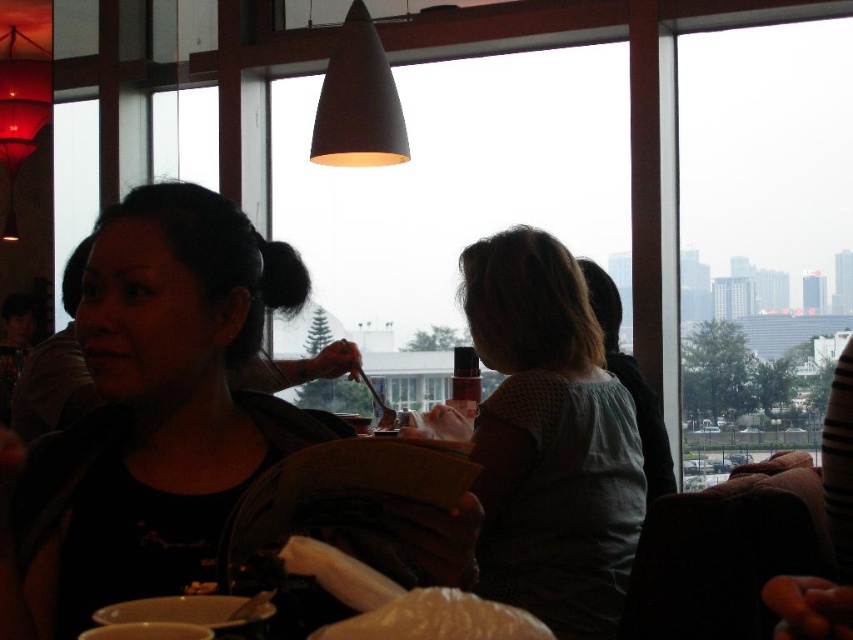
Looking at this image, you are a waiter in this restaurant and need to place a new menu on the table. The menu is 10 cm tall. There is space between the matte black shirt at center and the white fluffy bread at center. Can the menu fit vertically between them?

The matte black shirt at center is taller than the white fluffy bread at center. Since the menu is 10 cm tall, and the vertical space between them must be at least 10 cm, but the description only states the shirt is taller, not the available space. Therefore, it is uncertain if the menu will fit without more information about the actual space between them.

You are a customer sitting at the table in the restaurant. You want to see the city view outside through the transparent glass window at upper right, but the matte black shirt at center is blocking your view. Can you tell me which object you need to move to see the window?

The matte black shirt at center is shorter than the transparent glass window at upper right, so you can see the transparent glass window at upper right without moving the matte black shirt at center because it is shorter and won